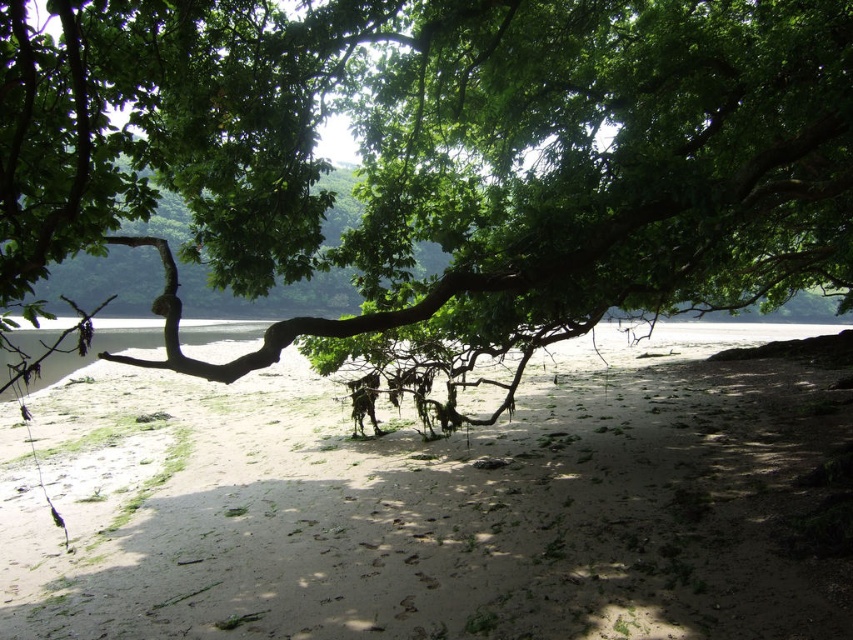
You are standing on the white sandy beach at center and want to pick a leaf from the green leafy tree at center. Can you reach the leaf without climbing the tree?

The green leafy tree at center is above the white sandy beach at center, so the leaves are higher than the beach level. You would need to climb the tree or use a tool to reach the leaves.

You are standing at the center of the beach and want to take a photo of the green leafy tree at center. In which direction should you move to get a better view of the tree?

Since the green leafy tree at center is located at point 0.241 on the x and 0.516 on the y coordinates, you should move towards the left to get a better view of the tree.

You are planning to set up a picnic area on the white sandy beach at center. Considering the green leafy tree at center provides shade, how does the width of the tree compare to the beach area to determine if it can cover part of the picnic spot?

The green leafy tree at center is thinner than the white sandy beach at center, so it may not provide sufficient coverage for the entire picnic area since the tree is narrower than the beach space.